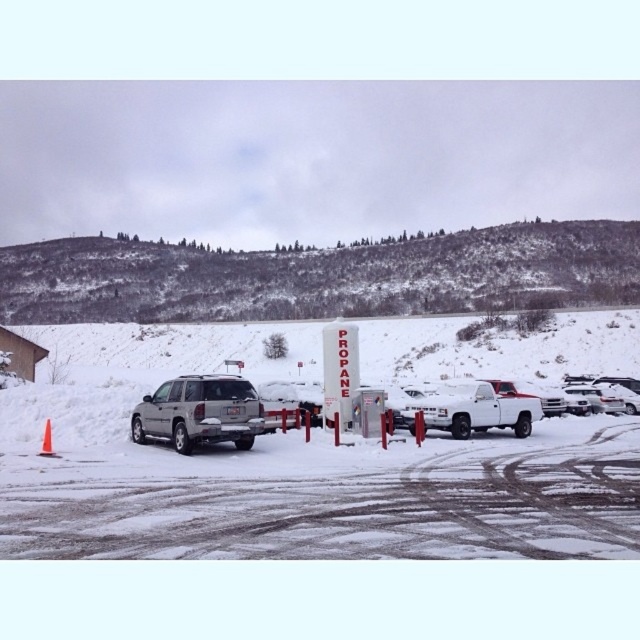
Question: Which object is farther from the camera taking this photo?

Choices:
 (A) satin silver suv at center
 (B) orange plastic cone at lower left

Answer: (A)

Question: Which point is closer to the camera?

Choices:
 (A) white matte truck at center
 (B) satin silver suv at center
 (C) orange plastic cone at lower left

Answer: (C)

Question: Which point is closer to the camera taking this photo?

Choices:
 (A) (477, 424)
 (B) (45, 429)

Answer: (B)

Question: Observing the image, what is the correct spatial positioning of satin silver suv at center in reference to white matte truck at center?

Choices:
 (A) below
 (B) above

Answer: (B)

Question: From the image, what is the correct spatial relationship of satin silver suv at center in relation to white matte truck at center?

Choices:
 (A) below
 (B) above

Answer: (B)

Question: Where is white matte truck at center located in relation to orange plastic cone at lower left in the image?

Choices:
 (A) right
 (B) left

Answer: (A)